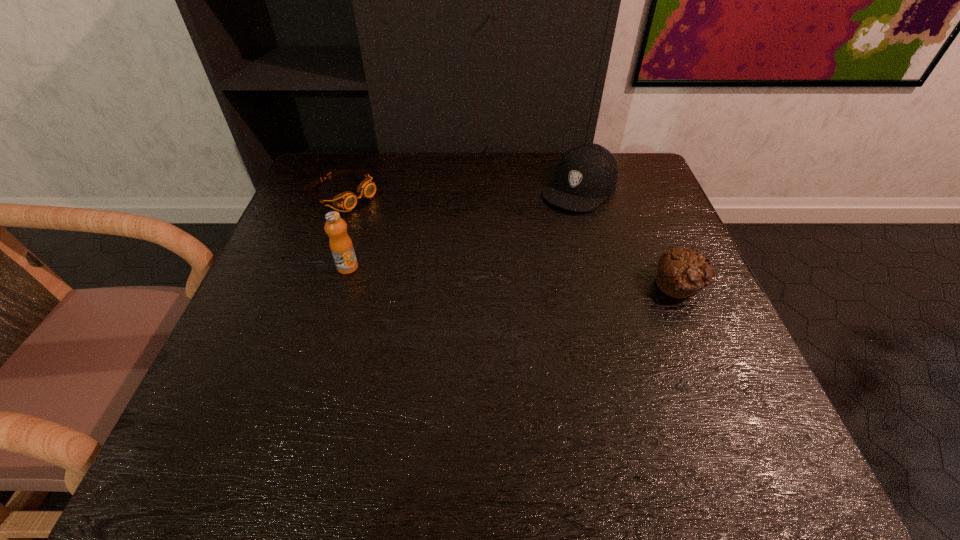
At what (x,y) coordinates should I click in order to perform the action: click on vacant position at the far edge of the desktop. Please return your answer as a coordinate pair (x, y). This screenshot has width=960, height=540. Looking at the image, I should click on (518, 188).

You are a GUI agent. You are given a task and a screenshot of the screen. Output one action in this format:
    pyautogui.click(x=<x>, y=<y>)
    Task: Click on the vacant space at the near edge
    The image size is (960, 540).
    Given the screenshot: What is the action you would take?
    pyautogui.click(x=550, y=377)

In the image, there is a desktop. Identify the location of vacant area at the left edge. (304, 259).

In the image, there is a desktop. Where is `vacant region at the far left corner`? This screenshot has height=540, width=960. vacant region at the far left corner is located at coordinates (357, 160).

The image size is (960, 540). I want to click on vacant space at the far right corner of the desktop, so click(614, 202).

At what (x,y) coordinates should I click in order to perform the action: click on vacant point located between the shortest object and the third tallest object. Please return your answer as a coordinate pair (x, y). This screenshot has height=540, width=960. Looking at the image, I should click on (511, 240).

Identify the location of free space between the tallest object and the cap. (464, 228).

Find the location of a particular element. This screenshot has height=540, width=960. free spot between the cap and the goggles is located at coordinates (460, 191).

Find the location of a particular element. This screenshot has height=540, width=960. free space that is in between the muffin and the tallest object is located at coordinates (514, 276).

Where is `unoccupied position between the second tallest object and the tallest object`? Image resolution: width=960 pixels, height=540 pixels. unoccupied position between the second tallest object and the tallest object is located at coordinates [464, 228].